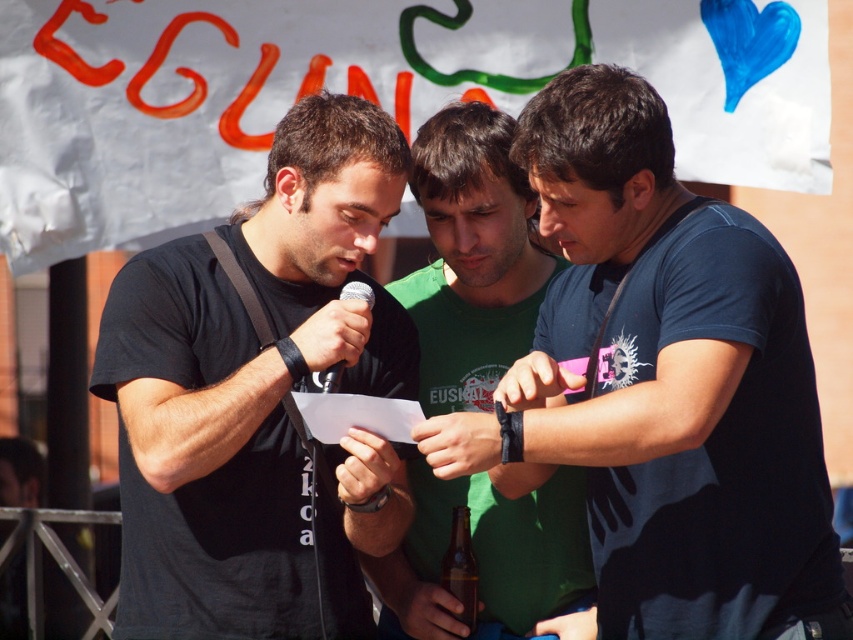
Based on the photo, is blue cotton shirt at center smaller than brown glass bottle at center?

Incorrect, blue cotton shirt at center is not smaller in size than brown glass bottle at center.

The width and height of the screenshot is (853, 640). I want to click on blue cotton shirt at center, so click(x=662, y=385).

Who is more distant from viewer, (788, 634) or (393, 164)?

The point (393, 164) is more distant.

The image size is (853, 640). Describe the element at coordinates (662, 385) in the screenshot. I see `blue cotton shirt at center` at that location.

The height and width of the screenshot is (640, 853). Identify the location of blue cotton shirt at center. (662, 385).

You are a GUI agent. You are given a task and a screenshot of the screen. Output one action in this format:
    pyautogui.click(x=<x>, y=<y>)
    Task: Click on the blue cotton shirt at center
    
    Given the screenshot: What is the action you would take?
    pyautogui.click(x=662, y=385)

Which is more to the left, blue cotton shirt at center or green cotton shirt at center?

green cotton shirt at center is more to the left.

Is blue cotton shirt at center closer to camera compared to green cotton shirt at center?

Yes.

Is point (633, 230) less distant than point (445, 483)?

Yes.

Locate an element on the screen. The height and width of the screenshot is (640, 853). blue cotton shirt at center is located at coordinates (662, 385).